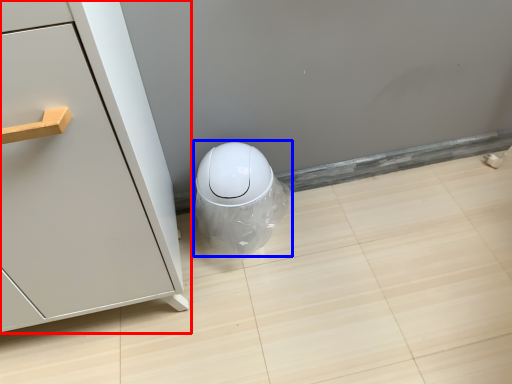
Question: Which object is further to the camera taking this photo, furniture (highlighted by a red box) or porcelain (highlighted by a blue box)?

Choices:
 (A) furniture
 (B) porcelain

Answer: (B)